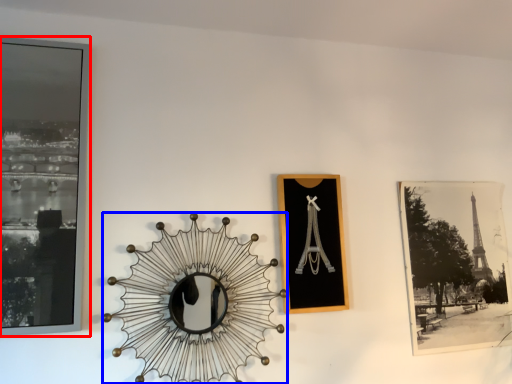
Question: Among these objects, which one is farthest to the camera, picture frame (highlighted by a red box) or design (highlighted by a blue box)?

Choices:
 (A) picture frame
 (B) design

Answer: (B)